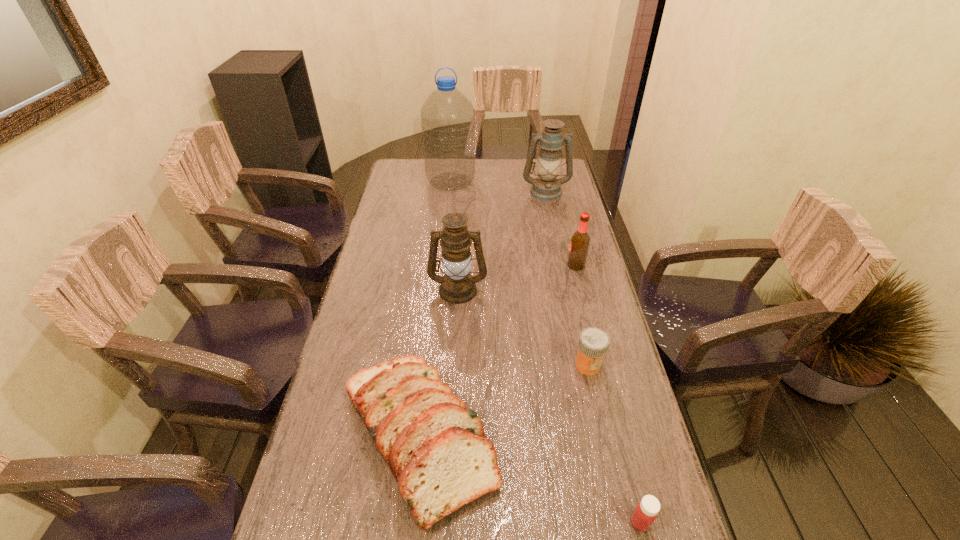
Identify the location of the shorter medicine. (645, 513).

In order to click on vacant space located on the back of the water jug in this screenshot , I will do `click(453, 161)`.

I want to click on free space located 0.310m on the left of the farther oil lamp, so click(447, 191).

Where is `vacant point located on the back of the fourth farthest object`? This screenshot has height=540, width=960. vacant point located on the back of the fourth farthest object is located at coordinates (460, 252).

This screenshot has height=540, width=960. In order to click on vacant position located on the left of the third farthest object in this screenshot , I will do `click(490, 266)`.

Locate an element on the screen. vacant space located on the right of the bread is located at coordinates (587, 437).

Where is `vacant area situated 0.120m on the label side of the taller medicine`? The height and width of the screenshot is (540, 960). vacant area situated 0.120m on the label side of the taller medicine is located at coordinates (599, 418).

I want to click on free space located 0.250m on the back of the shorter medicine, so click(611, 404).

The image size is (960, 540). In order to click on water jug that is at the far edge in this screenshot , I will do `click(447, 117)`.

At what (x,y) coordinates should I click in order to perform the action: click on oil lamp positioned at the far edge. Please return your answer as a coordinate pair (x, y). This screenshot has height=540, width=960. Looking at the image, I should click on (547, 187).